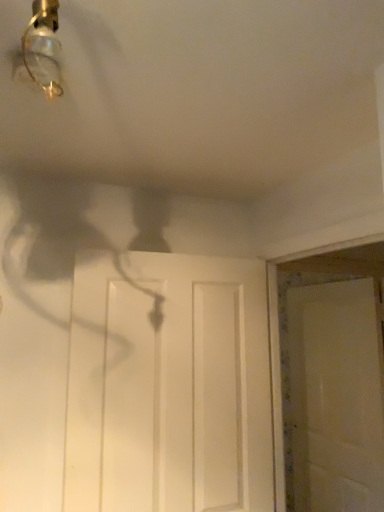
Where is `white matte door at center, the 1th door in the back-to-front sequence`? white matte door at center, the 1th door in the back-to-front sequence is located at coordinates (334, 399).

What do you see at coordinates (334, 399) in the screenshot? Image resolution: width=384 pixels, height=512 pixels. I see `white matte door at center, arranged as the second door when viewed from the front` at bounding box center [334, 399].

The image size is (384, 512). What do you see at coordinates (169, 386) in the screenshot? I see `white matte door at center, acting as the 1th door starting from the left` at bounding box center [169, 386].

You are a GUI agent. You are given a task and a screenshot of the screen. Output one action in this format:
    pyautogui.click(x=<x>, y=<y>)
    Task: Click on the white matte door at center, the first door viewed from the front
    The image size is (384, 512).
    Given the screenshot: What is the action you would take?
    pyautogui.click(x=169, y=386)

Identify the location of white matte door at center, arranged as the second door when viewed from the front. The width and height of the screenshot is (384, 512). (334, 399).

Which is more to the right, white matte door at center, the second door positioned from the right, or white matte door at center, the 1th door in the back-to-front sequence?

white matte door at center, the 1th door in the back-to-front sequence, is more to the right.

Considering their positions, is white matte door at center, the second door positioned from the right, located in front of or behind white matte door at center, arranged as the second door when viewed from the front?

white matte door at center, the second door positioned from the right, is positioned closer to the viewer than white matte door at center, arranged as the second door when viewed from the front.

Between point (173, 298) and point (350, 343), which one is positioned behind?

The point (350, 343) is more distant.

From the image's perspective, who appears lower, white matte door at center, the second door positioned from the right, or white matte door at center, which is the first door from right to left?

From the image's view, white matte door at center, which is the first door from right to left, is below.

Consider the image. From a real-world perspective, which is physically above, white matte door at center, acting as the 1th door starting from the left, or white matte door at center, which ranks as the second door in left-to-right order?

In real-world perspective, white matte door at center, acting as the 1th door starting from the left, is above.

Does white matte door at center, the 2th door when ordered from back to front, have a lesser width compared to white matte door at center, the 1th door in the back-to-front sequence?

No, white matte door at center, the 2th door when ordered from back to front, is not thinner than white matte door at center, the 1th door in the back-to-front sequence.

Considering the sizes of objects white matte door at center, acting as the 1th door starting from the left, and white matte door at center, arranged as the second door when viewed from the front, in the image provided, who is shorter, white matte door at center, acting as the 1th door starting from the left, or white matte door at center, arranged as the second door when viewed from the front,?

white matte door at center, acting as the 1th door starting from the left.

Considering the sizes of objects white matte door at center, acting as the 1th door starting from the left, and white matte door at center, which is the first door from right to left, in the image provided, who is bigger, white matte door at center, acting as the 1th door starting from the left, or white matte door at center, which is the first door from right to left,?

With larger size is white matte door at center, acting as the 1th door starting from the left.

From the picture: Which is correct: white matte door at center, acting as the 1th door starting from the left, is inside white matte door at center, which ranks as the second door in left-to-right order, or outside of it?

white matte door at center, acting as the 1th door starting from the left, is not inside white matte door at center, which ranks as the second door in left-to-right order, it's outside.

Is there a large distance between white matte door at center, acting as the 1th door starting from the left, and white matte door at center, arranged as the second door when viewed from the front?

white matte door at center, acting as the 1th door starting from the left, is far away from white matte door at center, arranged as the second door when viewed from the front.

From the picture: Could you tell me if white matte door at center, the first door viewed from the front, is turned towards white matte door at center, the 1th door in the back-to-front sequence?

No, white matte door at center, the first door viewed from the front, does not turn towards white matte door at center, the 1th door in the back-to-front sequence.

How many degrees apart are the facing directions of white matte door at center, the second door positioned from the right, and white matte door at center, arranged as the second door when viewed from the front?

The angular difference between white matte door at center, the second door positioned from the right, and white matte door at center, arranged as the second door when viewed from the front, is 90.2 degrees.

Measure the distance from white matte door at center, the 2th door when ordered from back to front, to white matte door at center, which is the first door from right to left.

white matte door at center, the 2th door when ordered from back to front, is 1.34 meters away from white matte door at center, which is the first door from right to left.

Locate an element on the screen. The height and width of the screenshot is (512, 384). door on the right of white matte door at center, the first door viewed from the front is located at coordinates (334, 399).

Considering the relative positions of white matte door at center, which is the first door from right to left, and white matte door at center, the 2th door when ordered from back to front, in the image provided, is white matte door at center, which is the first door from right to left, to the right of white matte door at center, the 2th door when ordered from back to front, from the viewer's perspective?

Yes.

Is the position of white matte door at center, the 1th door in the back-to-front sequence, more distant than that of white matte door at center, acting as the 1th door starting from the left?

That is True.

Does point (333, 402) come closer to viewer compared to point (98, 403)?

No.

From the image's perspective, is white matte door at center, the 1th door in the back-to-front sequence, beneath white matte door at center, acting as the 1th door starting from the left?

Correct, white matte door at center, the 1th door in the back-to-front sequence, appears lower than white matte door at center, acting as the 1th door starting from the left, in the image.

From a real-world perspective, is white matte door at center, arranged as the second door when viewed from the front, positioned above or below white matte door at center, the second door positioned from the right?

Clearly, from a real-world perspective, white matte door at center, arranged as the second door when viewed from the front, is below white matte door at center, the second door positioned from the right.

Is white matte door at center, which ranks as the second door in left-to-right order, thinner than white matte door at center, the 2th door when ordered from back to front?

Correct, the width of white matte door at center, which ranks as the second door in left-to-right order, is less than that of white matte door at center, the 2th door when ordered from back to front.

Who is shorter, white matte door at center, which ranks as the second door in left-to-right order, or white matte door at center, the second door positioned from the right?

Standing shorter between the two is white matte door at center, the second door positioned from the right.

Can you confirm if white matte door at center, which is the first door from right to left, is smaller than white matte door at center, the second door positioned from the right?

Correct, white matte door at center, which is the first door from right to left, occupies less space than white matte door at center, the second door positioned from the right.

Is white matte door at center, the 1th door in the back-to-front sequence, inside or outside of white matte door at center, acting as the 1th door starting from the left?

white matte door at center, the 1th door in the back-to-front sequence, is spatially situated outside white matte door at center, acting as the 1th door starting from the left.

Would you consider white matte door at center, arranged as the second door when viewed from the front, to be distant from white matte door at center, the 2th door when ordered from back to front?

white matte door at center, arranged as the second door when viewed from the front, is positioned a significant distance from white matte door at center, the 2th door when ordered from back to front.

Is white matte door at center, which is the first door from right to left, turned away from white matte door at center, the first door viewed from the front?

white matte door at center, which is the first door from right to left, does not have its back to white matte door at center, the first door viewed from the front.

Locate an element on the screen. This screenshot has height=512, width=384. door that is in front of the white matte door at center, the 1th door in the back-to-front sequence is located at coordinates (169, 386).

At what (x,y) coordinates should I click in order to perform the action: click on door lying behind the white matte door at center, the 2th door when ordered from back to front. Please return your answer as a coordinate pair (x, y). Looking at the image, I should click on (334, 399).

At what (x,y) coordinates should I click in order to perform the action: click on door on the right side of white matte door at center, the first door viewed from the front. Please return your answer as a coordinate pair (x, y). The image size is (384, 512). Looking at the image, I should click on (334, 399).